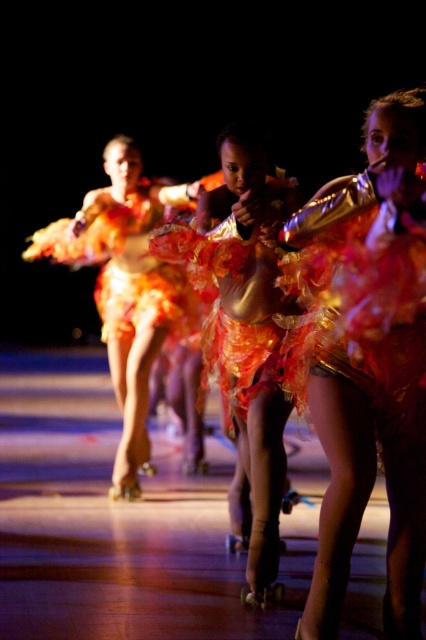
You are a stage designer who needs to ensure that all performers have costumes with skirts wider than their dresses. Looking at the shiny orange fabric skirt at center and the shiny orange fabric dress at center, does the skirt meet the requirement?

The shiny orange fabric skirt at center has a width less than the shiny orange fabric dress at center, so it does not meet the requirement of having a skirt wider than the dress.

In the scene shown: You are a photographer aiming to capture the dancers in the center of the stage. You notice two skirts at the center, the shiny metallic skirt at center and the shiny orange fabric skirt at center. Which skirt should you focus on if you want to capture the larger one?

The shiny orange fabric skirt at center is larger than the shiny metallic skirt at center, so you should focus on the shiny orange fabric skirt at center to capture the larger one.